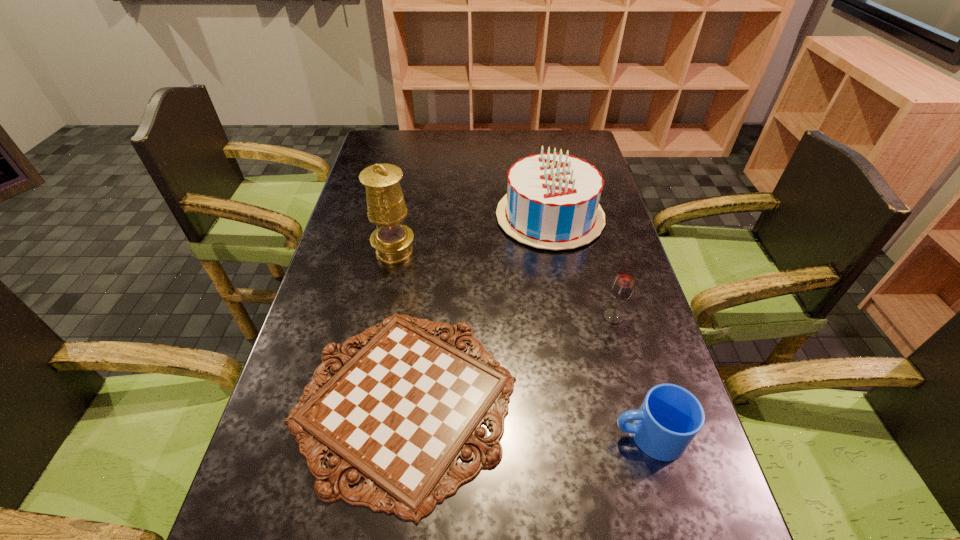
The width and height of the screenshot is (960, 540). What are the coordinates of `vacant region located on the side of the mug with the handle` in the screenshot? It's located at (433, 436).

Where is `vacant area situated 0.380m on the back of the chessboard`? This screenshot has height=540, width=960. vacant area situated 0.380m on the back of the chessboard is located at coordinates (429, 221).

The width and height of the screenshot is (960, 540). I want to click on oil lamp located in the left edge section of the desktop, so click(x=386, y=207).

The height and width of the screenshot is (540, 960). I want to click on chessboard positioned at the left edge, so click(x=399, y=413).

Where is `birthday cake positioned at the right edge`? birthday cake positioned at the right edge is located at coordinates (552, 202).

Locate an element on the screen. The width and height of the screenshot is (960, 540). glass drink container present at the right edge is located at coordinates (622, 287).

In order to click on mug situated at the right edge in this screenshot , I will do `click(670, 417)`.

I want to click on free space at the far edge, so click(x=459, y=134).

In order to click on free location at the left edge in this screenshot , I will do `click(302, 374)`.

Where is `vacant space at the right edge of the desktop`? Image resolution: width=960 pixels, height=540 pixels. vacant space at the right edge of the desktop is located at coordinates (602, 237).